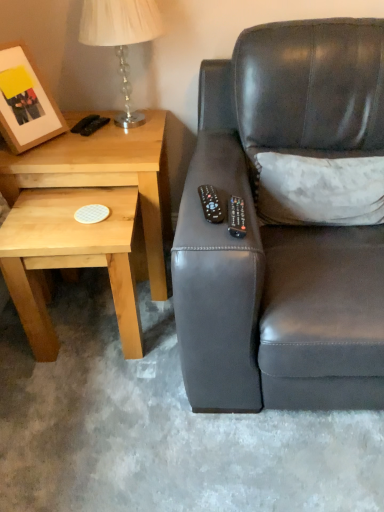
Question: From the image's perspective, does matte black couch at right appear higher than wooden matte picture frame at upper left?

Choices:
 (A) yes
 (B) no

Answer: (B)

Question: Is the surface of matte black couch at right in direct contact with wooden matte picture frame at upper left?

Choices:
 (A) no
 (B) yes

Answer: (A)

Question: Considering the relative sizes of matte black couch at right and wooden matte picture frame at upper left in the image provided, is matte black couch at right shorter than wooden matte picture frame at upper left?

Choices:
 (A) no
 (B) yes

Answer: (A)

Question: Is matte black couch at right located outside wooden matte picture frame at upper left?

Choices:
 (A) no
 (B) yes

Answer: (B)

Question: Can you confirm if matte black couch at right is bigger than wooden matte picture frame at upper left?

Choices:
 (A) yes
 (B) no

Answer: (A)

Question: Can you confirm if matte black couch at right is positioned to the right of wooden matte picture frame at upper left?

Choices:
 (A) yes
 (B) no

Answer: (A)

Question: Is white textured pillow at upper right thinner than light wood/textureobject at left?

Choices:
 (A) yes
 (B) no

Answer: (A)

Question: Is white textured pillow at upper right placed right next to light wood/textureobject at left?

Choices:
 (A) yes
 (B) no

Answer: (B)

Question: Does white textured pillow at upper right have a smaller size compared to light wood/textureobject at left?

Choices:
 (A) no
 (B) yes

Answer: (B)

Question: Is white textured pillow at upper right taller than light wood/textureobject at left?

Choices:
 (A) yes
 (B) no

Answer: (B)

Question: Is the position of white textured pillow at upper right more distant than that of light wood/textureobject at left?

Choices:
 (A) no
 (B) yes

Answer: (A)

Question: From a real-world perspective, is white textured pillow at upper right located higher than light wood/textureobject at left?

Choices:
 (A) yes
 (B) no

Answer: (A)

Question: Considering the relative sizes of black plastic remote at center, the second remote from the right, and matte black couch at right in the image provided, is black plastic remote at center, the second remote from the right, taller than matte black couch at right?

Choices:
 (A) no
 (B) yes

Answer: (A)